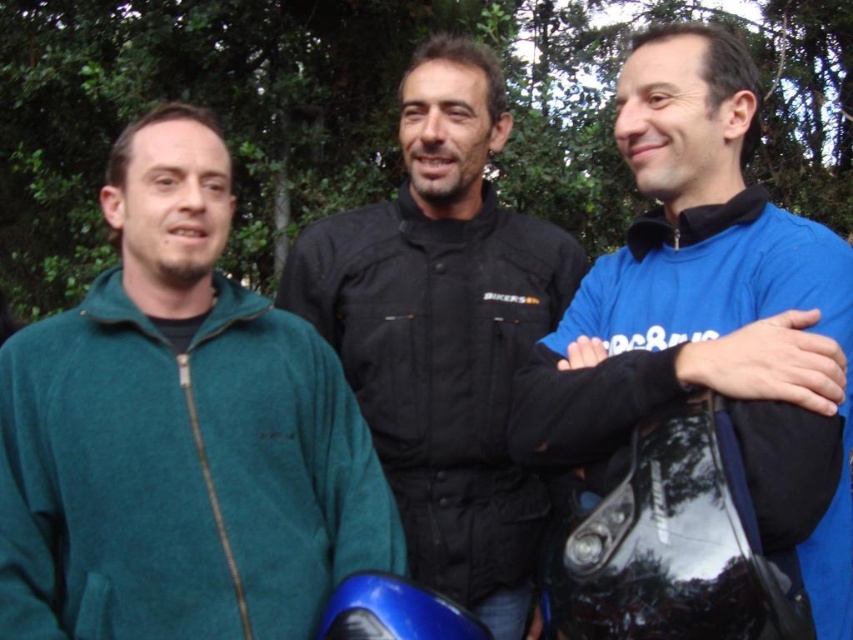
You are standing at the position of the camera. You want to take a photo of the teal fleece jacket at left without moving. Can you reach it with your hand to adjust it?

The teal fleece jacket at left is 2.21 meters away from the camera, so you cannot reach it with your hand to adjust it while standing at the camera position.